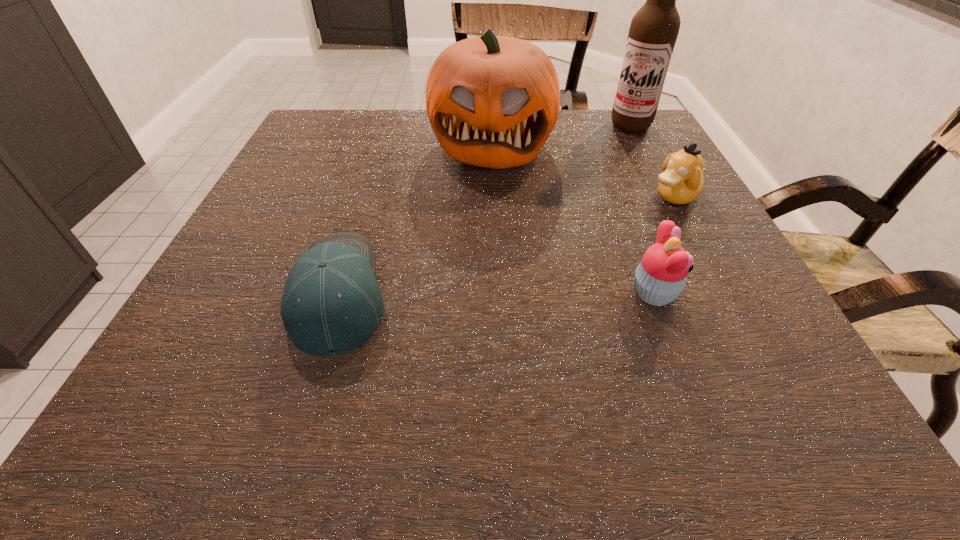
Where is `the leftmost object`? The height and width of the screenshot is (540, 960). the leftmost object is located at coordinates (331, 303).

Identify the location of the shortest object. Image resolution: width=960 pixels, height=540 pixels. 331,303.

This screenshot has width=960, height=540. I want to click on cupcake, so click(x=660, y=277).

The width and height of the screenshot is (960, 540). Find the location of `the second object from left to right`. the second object from left to right is located at coordinates (492, 101).

Identify the location of the fourth shortest object. (492, 101).

Locate an element on the screen. The image size is (960, 540). alcohol is located at coordinates (653, 32).

Find the location of `duckling`. duckling is located at coordinates (682, 181).

The width and height of the screenshot is (960, 540). In order to click on vacant space situated on the right of the leftmost object in this screenshot , I will do `click(526, 293)`.

The height and width of the screenshot is (540, 960). I want to click on vacant region located on the face of the fourth shortest object, so click(x=479, y=240).

At what (x,y) coordinates should I click in order to perform the action: click on vacant space located 0.250m on the face of the fourth shortest object. Please return your answer as a coordinate pair (x, y). Looking at the image, I should click on (477, 254).